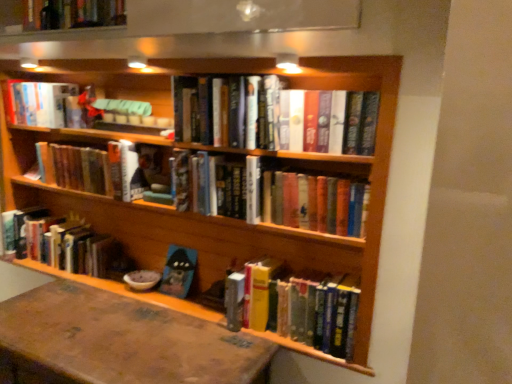
Describe the element at coordinates (217, 188) in the screenshot. The width and height of the screenshot is (512, 384). I see `hardcover books at center, which is the fourth book in top-to-bottom order` at that location.

Where is `hardcover book at lower left, acting as the 5th book starting from the top`? The height and width of the screenshot is (384, 512). hardcover book at lower left, acting as the 5th book starting from the top is located at coordinates (61, 243).

What is the approximate height of hardcover books at center, arranged as the third book when viewed from the top?

The height of hardcover books at center, arranged as the third book when viewed from the top, is 8.68 inches.

What do you see at coordinates (96, 169) in the screenshot? I see `hardcover books at center, the fifth book in the bottom-to-top sequence` at bounding box center [96, 169].

In order to face matte blue book at center, which appears as the 6th book when viewed from the top, should I rotate leftwards or rightwards?

A 10.511 degree turn to the left will do.

Measure the distance between point (222, 91) and camera.

They are 1.47 meters apart.

Image resolution: width=512 pixels, height=384 pixels. What do you see at coordinates (296, 306) in the screenshot?
I see `hardcover books at center, which is the seventh book from top to bottom` at bounding box center [296, 306].

Where is `hardcover books at center, which is the fourth book in top-to-bottom order`? hardcover books at center, which is the fourth book in top-to-bottom order is located at coordinates (217, 188).

Is the depth of hardcover book at upper left, which appears as the seventh book when ordered from the bottom, greater than that of hardcover books at center, positioned as the sixth book in bottom-to-top order?

Yes, hardcover book at upper left, which appears as the seventh book when ordered from the bottom, is further from the viewer.

Is hardcover book at upper left, which is counted as the 1th book, starting from the top, far from hardcover books at center, positioned as the sixth book in bottom-to-top order?

No, there isn't a large distance between hardcover book at upper left, which is counted as the 1th book, starting from the top, and hardcover books at center, positioned as the sixth book in bottom-to-top order.

Which is more to the left, hardcover book at upper left, which appears as the seventh book when ordered from the bottom, or hardcover books at center, positioned as the sixth book in bottom-to-top order?

hardcover book at upper left, which appears as the seventh book when ordered from the bottom.

Is hardcover books at center, acting as the second book starting from the top, closer to camera compared to matte blue book at center, placed as the 2th book when sorted from bottom to top?

Yes, hardcover books at center, acting as the second book starting from the top, is closer to the camera.

Are hardcover books at center, acting as the second book starting from the top, and matte blue book at center, which appears as the 6th book when viewed from the top, beside each other?

No, hardcover books at center, acting as the second book starting from the top, is not with matte blue book at center, which appears as the 6th book when viewed from the top.

Can you confirm if hardcover books at center, positioned as the sixth book in bottom-to-top order, is shorter than matte blue book at center, which appears as the 6th book when viewed from the top?

No.

How much distance is there between hardcover books at center, which is the fourth book in top-to-bottom order, and hardcover books at center, acting as the second book starting from the top?

hardcover books at center, which is the fourth book in top-to-bottom order, and hardcover books at center, acting as the second book starting from the top, are 8.68 inches apart from each other.

Considering the relative sizes of hardcover books at center, the fourth book positioned from the bottom, and hardcover books at center, positioned as the sixth book in bottom-to-top order, in the image provided, is hardcover books at center, the fourth book positioned from the bottom, smaller than hardcover books at center, positioned as the sixth book in bottom-to-top order,?

Actually, hardcover books at center, the fourth book positioned from the bottom, might be larger than hardcover books at center, positioned as the sixth book in bottom-to-top order.

From the image's perspective, which one is positioned lower, hardcover books at center, the fourth book positioned from the bottom, or hardcover books at center, acting as the second book starting from the top?

From the image's view, hardcover books at center, the fourth book positioned from the bottom, is below.

Are hardcover books at center, the fifth book in the bottom-to-top sequence, and matte blue book at center, placed as the 2th book when sorted from bottom to top, far apart?

No, there isn't a large distance between hardcover books at center, the fifth book in the bottom-to-top sequence, and matte blue book at center, placed as the 2th book when sorted from bottom to top.

Visually, is hardcover books at center, the fifth book in the bottom-to-top sequence, positioned to the left or to the right of matte blue book at center, placed as the 2th book when sorted from bottom to top?

hardcover books at center, the fifth book in the bottom-to-top sequence, is positioned on matte blue book at center, placed as the 2th book when sorted from bottom to top,'s left side.

Measure the distance from hardcover books at center, arranged as the third book when viewed from the top, to matte blue book at center, placed as the 2th book when sorted from bottom to top.

hardcover books at center, arranged as the third book when viewed from the top, is 18.20 inches from matte blue book at center, placed as the 2th book when sorted from bottom to top.

Considering the sizes of objects hardcover books at center, arranged as the third book when viewed from the top, and matte blue book at center, which appears as the 6th book when viewed from the top, in the image provided, who is thinner, hardcover books at center, arranged as the third book when viewed from the top, or matte blue book at center, which appears as the 6th book when viewed from the top,?

matte blue book at center, which appears as the 6th book when viewed from the top, is thinner.

Which is in front, hardcover book at lower left, acting as the 5th book starting from the top, or hardcover books at center, positioned as the sixth book in bottom-to-top order?

hardcover books at center, positioned as the sixth book in bottom-to-top order.

Would you say hardcover books at center, acting as the second book starting from the top, is part of hardcover book at lower left, the 3th book from the bottom,'s contents?

No, hardcover books at center, acting as the second book starting from the top, is not surrounded by hardcover book at lower left, the 3th book from the bottom.

Between point (38, 231) and point (198, 134), which one is positioned behind?

The point (38, 231) is more distant.

Between brown leather table at lower left and hardcover book at upper left, which appears as the seventh book when ordered from the bottom, which one appears on the right side from the viewer's perspective?

brown leather table at lower left.

Considering the relative positions of brown leather table at lower left and hardcover book at upper left, which appears as the seventh book when ordered from the bottom, in the image provided, is brown leather table at lower left behind hardcover book at upper left, which appears as the seventh book when ordered from the bottom,?

No, brown leather table at lower left is closer to the viewer.

Who is shorter, brown leather table at lower left or hardcover book at upper left, which appears as the seventh book when ordered from the bottom?

With less height is hardcover book at upper left, which appears as the seventh book when ordered from the bottom.

Would you say brown leather table at lower left contains hardcover book at upper left, which is counted as the 1th book, starting from the top?

Definitely not — hardcover book at upper left, which is counted as the 1th book, starting from the top, is not inside brown leather table at lower left.

How many degrees apart are the facing directions of hardcover books at center, marked as the 1th book in a bottom-to-top arrangement, and hardcover book at upper left, which appears as the seventh book when ordered from the bottom?

The angle between the facing direction of hardcover books at center, marked as the 1th book in a bottom-to-top arrangement, and the facing direction of hardcover book at upper left, which appears as the seventh book when ordered from the bottom, is 0.000356 degrees.

From the image's perspective, which object appears higher, hardcover books at center, marked as the 1th book in a bottom-to-top arrangement, or hardcover book at upper left, which is counted as the 1th book, starting from the top?

hardcover book at upper left, which is counted as the 1th book, starting from the top, is shown above in the image.

Is hardcover books at center, marked as the 1th book in a bottom-to-top arrangement, not close to hardcover book at upper left, which appears as the seventh book when ordered from the bottom?

Indeed, hardcover books at center, marked as the 1th book in a bottom-to-top arrangement, is not near hardcover book at upper left, which appears as the seventh book when ordered from the bottom.

Is hardcover books at center, marked as the 1th book in a bottom-to-top arrangement, surrounding hardcover book at upper left, which is counted as the 1th book, starting from the top?

Actually, hardcover book at upper left, which is counted as the 1th book, starting from the top, is outside hardcover books at center, marked as the 1th book in a bottom-to-top arrangement.

Where is `the 1st book positioned below the hardcover book at upper left, which is counted as the 1th book, starting from the top (from the image's perspective)`? the 1st book positioned below the hardcover book at upper left, which is counted as the 1th book, starting from the top (from the image's perspective) is located at coordinates (273, 115).

Find the location of `the 6th book directly above the matte blue book at center, which appears as the 6th book when viewed from the top (from a real-world perspective)`. the 6th book directly above the matte blue book at center, which appears as the 6th book when viewed from the top (from a real-world perspective) is located at coordinates (273, 115).

Estimate the real-world distances between objects in this image. Which object is further from hardcover book at lower left, acting as the 5th book starting from the top, hardcover books at center, marked as the 1th book in a bottom-to-top arrangement, or hardcover book at upper left, which appears as the seventh book when ordered from the bottom?

hardcover books at center, marked as the 1th book in a bottom-to-top arrangement, lies further to hardcover book at lower left, acting as the 5th book starting from the top, than the other object.

Based on their spatial positions, is hardcover books at center, positioned as the sixth book in bottom-to-top order, or matte blue book at center, which appears as the 6th book when viewed from the top, closer to brown leather table at lower left?

matte blue book at center, which appears as the 6th book when viewed from the top.

When comparing their distances from hardcover books at center, which is the fourth book in top-to-bottom order, does hardcover books at center, the fifth book in the bottom-to-top sequence, or hardcover book at lower left, the 3th book from the bottom, seem closer?

Based on the image, hardcover books at center, the fifth book in the bottom-to-top sequence, appears to be nearer to hardcover books at center, which is the fourth book in top-to-bottom order.

From the image, which object appears to be nearer to hardcover books at center, which is the seventh book from top to bottom, hardcover books at center, which is the fourth book in top-to-bottom order, or hardcover book at lower left, acting as the 5th book starting from the top?

hardcover books at center, which is the fourth book in top-to-bottom order, is closer to hardcover books at center, which is the seventh book from top to bottom.

Considering their positions, is hardcover books at center, the fourth book positioned from the bottom, positioned closer to hardcover books at center, acting as the second book starting from the top, than hardcover books at center, the fifth book in the bottom-to-top sequence?

Based on the image, hardcover books at center, the fourth book positioned from the bottom, appears to be nearer to hardcover books at center, acting as the second book starting from the top.

From the picture: Estimate the real-world distances between objects in this image. Which object is further from hardcover books at center, arranged as the third book when viewed from the top, hardcover book at lower left, the 3th book from the bottom, or brown leather table at lower left?

brown leather table at lower left lies further to hardcover books at center, arranged as the third book when viewed from the top, than the other object.

From the image, which object appears to be nearer to hardcover books at center, arranged as the third book when viewed from the top, hardcover book at upper left, which appears as the seventh book when ordered from the bottom, or hardcover books at center, acting as the second book starting from the top?

Among the two, hardcover book at upper left, which appears as the seventh book when ordered from the bottom, is located nearer to hardcover books at center, arranged as the third book when viewed from the top.

Based on their spatial positions, is hardcover books at center, arranged as the third book when viewed from the top, or hardcover books at center, the fourth book positioned from the bottom, further from matte blue book at center, placed as the 2th book when sorted from bottom to top?

The object further to matte blue book at center, placed as the 2th book when sorted from bottom to top, is hardcover books at center, arranged as the third book when viewed from the top.

Where is `table between hardcover book at lower left, the 3th book from the bottom, and hardcover books at center, which is the fourth book in top-to-bottom order`? The image size is (512, 384). table between hardcover book at lower left, the 3th book from the bottom, and hardcover books at center, which is the fourth book in top-to-bottom order is located at coordinates (123, 340).

I want to click on book between hardcover book at lower left, the 3th book from the bottom, and matte blue book at center, placed as the 2th book when sorted from bottom to top, from left to right, so click(96, 169).

In order to click on table located between hardcover book at upper left, which is counted as the 1th book, starting from the top, and hardcover books at center, marked as the 1th book in a bottom-to-top arrangement, in the left-right direction in this screenshot , I will do `click(123, 340)`.

Where is `table between hardcover books at center, arranged as the third book when viewed from the top, and hardcover books at center, which is the seventh book from top to bottom, in the horizontal direction`? This screenshot has width=512, height=384. table between hardcover books at center, arranged as the third book when viewed from the top, and hardcover books at center, which is the seventh book from top to bottom, in the horizontal direction is located at coordinates (123, 340).